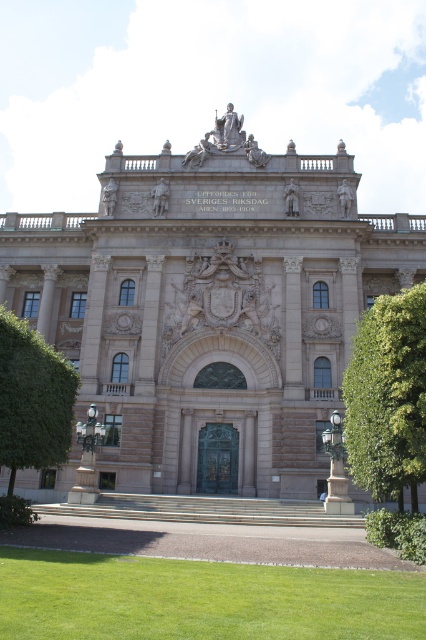
Question: Does beige stone palace at center appear under green leafy tree at right?

Choices:
 (A) yes
 (B) no

Answer: (B)

Question: Does beige stone palace at center have a lesser width compared to polished bronze lamp post at lower right?

Choices:
 (A) no
 (B) yes

Answer: (A)

Question: Considering the relative positions of green leafy tree at right and polished bronze lamp post at lower right in the image provided, where is green leafy tree at right located with respect to polished bronze lamp post at lower right?

Choices:
 (A) above
 (B) below

Answer: (A)

Question: Considering the real-world distances, which object is closest to the green leafy tree at left?

Choices:
 (A) green leafy tree at right
 (B) polished bronze lamp post at lower right

Answer: (B)

Question: Among these objects, which one is nearest to the camera?

Choices:
 (A) green leafy tree at left
 (B) polished bronze lamp post at lower right
 (C) beige stone palace at center
 (D) green leafy tree at right

Answer: (D)

Question: Which is farther from the green leafy tree at left?

Choices:
 (A) beige stone palace at center
 (B) polished bronze lamp post at lower right

Answer: (B)